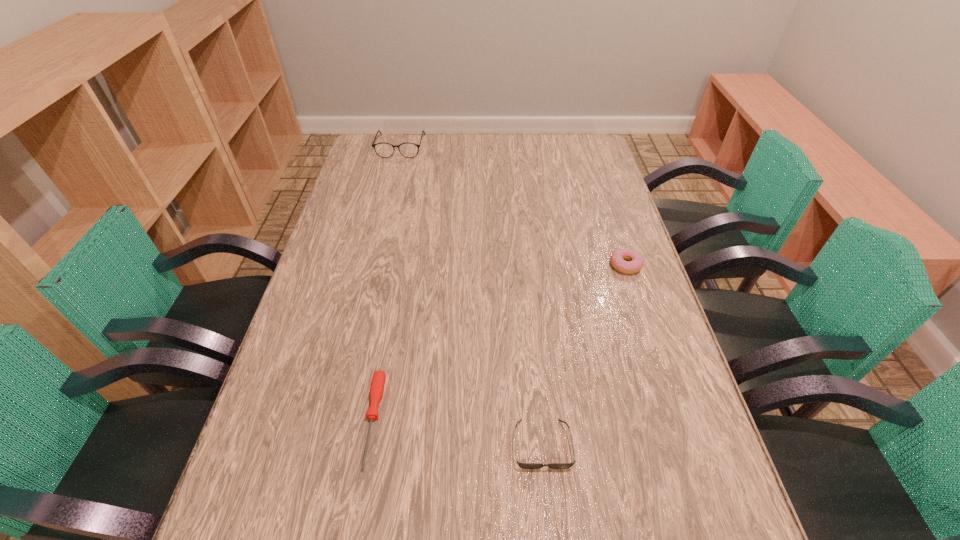
At what (x,y) coordinates should I click in order to perform the action: click on spectacles. Please return your answer as a coordinate pair (x, y). Image resolution: width=960 pixels, height=540 pixels. Looking at the image, I should click on (385, 150).

Locate an element on the screen. This screenshot has height=540, width=960. the tallest object is located at coordinates (385, 150).

You are a GUI agent. You are given a task and a screenshot of the screen. Output one action in this format:
    pyautogui.click(x=<x>, y=<y>)
    Task: Click on the second tallest object
    This screenshot has height=540, width=960.
    Given the screenshot: What is the action you would take?
    pyautogui.click(x=635, y=262)

Locate an element on the screen. The height and width of the screenshot is (540, 960). the rightmost object is located at coordinates (635, 262).

At what (x,y) coordinates should I click in order to perform the action: click on sunglasses. Please return your answer as a coordinate pair (x, y). This screenshot has height=540, width=960. Looking at the image, I should click on (522, 465).

What are the coordinates of `the shortest object` in the screenshot? It's located at (378, 381).

Identify the location of vacant region located 0.110m on the front-facing side of the spectacles. pyautogui.click(x=394, y=175).

The image size is (960, 540). Identify the location of vacant space located 0.270m on the left of the third nearest object. (515, 265).

Image resolution: width=960 pixels, height=540 pixels. I want to click on vacant area situated at the tip of the screwdriver, so click(359, 499).

Identify the location of object that is at the far edge. This screenshot has width=960, height=540. (385, 150).